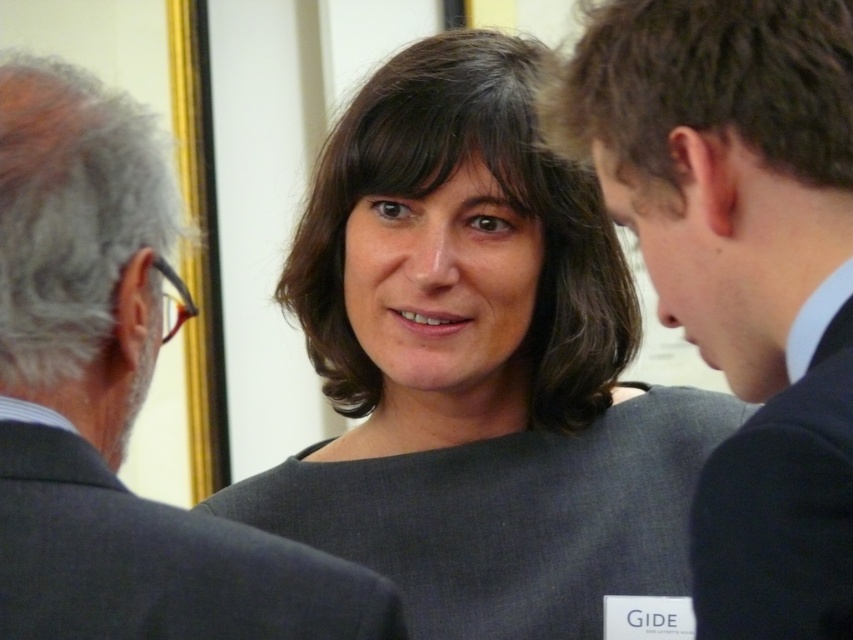
Question: Which object appears closest to the camera in this image?

Choices:
 (A) dark gray dress at center
 (B) dark gray wool suit at center
 (C) black smooth suit at right
 (D) black suit at center

Answer: (D)

Question: Estimate the real-world distances between objects in this image. Which object is closer to the dark gray dress at center?

Choices:
 (A) black suit at center
 (B) black smooth suit at right

Answer: (A)

Question: Can you confirm if dark gray dress at center is thinner than black smooth suit at right?

Choices:
 (A) no
 (B) yes

Answer: (A)

Question: Is the position of black suit at center more distant than that of dark gray suit at center?

Choices:
 (A) no
 (B) yes

Answer: (A)

Question: Does dark gray dress at center have a larger size compared to black suit at center?

Choices:
 (A) yes
 (B) no

Answer: (A)

Question: Which of the following is the farthest from the observer?

Choices:
 (A) dark gray wool suit at center
 (B) black suit at center
 (C) dark gray dress at center

Answer: (C)